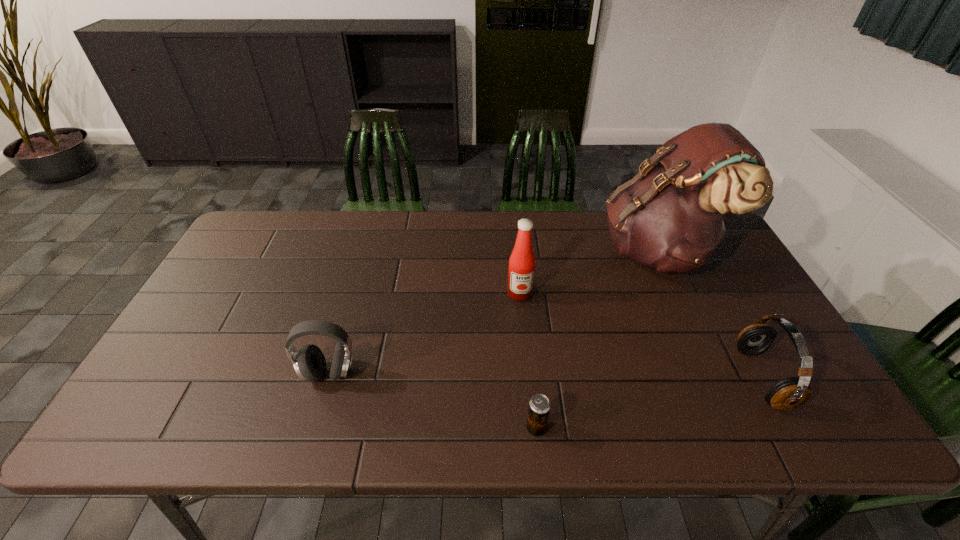
I want to click on vacant area that lies between the nearest object and the satchel, so click(x=597, y=340).

Where is `free space between the second tallest object and the shortest object`? The image size is (960, 540). free space between the second tallest object and the shortest object is located at coordinates (528, 361).

Locate an element on the screen. Image resolution: width=960 pixels, height=540 pixels. free space between the fourth shortest object and the satchel is located at coordinates (588, 272).

You are a GUI agent. You are given a task and a screenshot of the screen. Output one action in this format:
    pyautogui.click(x=<x>, y=<y>)
    Task: Click on the free point between the tallest object and the leftmost object
    The image size is (960, 540).
    Given the screenshot: What is the action you would take?
    pyautogui.click(x=493, y=312)

Identify the location of free spot between the right headset and the condiment. The height and width of the screenshot is (540, 960). (641, 335).

Identify the location of vacant space that's between the beer can and the leftmost object. Image resolution: width=960 pixels, height=540 pixels. (433, 401).

I want to click on object that stands as the second closest to the nearest object, so click(309, 362).

Locate which object ranks second in proximity to the condiment. Please provide its 2D coordinates. Your answer should be formatted as a tuple, i.e. [(x, y)], where the tuple contains the x and y coordinates of a point satisfying the conditions above.

[(539, 406)]

Identify the location of vacant region that satisfies the following two spatial constraints: 1. on the ear cups of the leftmost object; 2. on the right side of the nearest object. (313, 428).

Image resolution: width=960 pixels, height=540 pixels. Find the location of `vacant region that satisfies the following two spatial constraints: 1. at the front of the satchel with buckles; 2. on the ear cups of the leftmost object`. vacant region that satisfies the following two spatial constraints: 1. at the front of the satchel with buckles; 2. on the ear cups of the leftmost object is located at coordinates (714, 373).